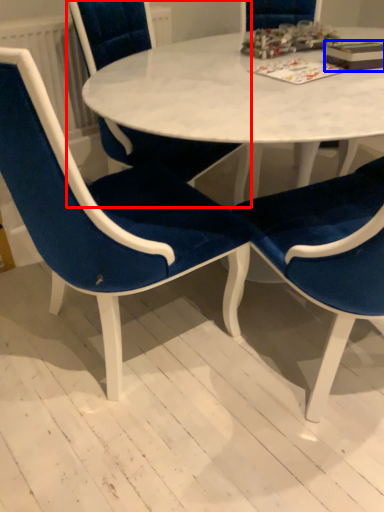
Question: Among these objects, which one is farthest to the camera, chair (highlighted by a red box) or book (highlighted by a blue box)?

Choices:
 (A) chair
 (B) book

Answer: (B)